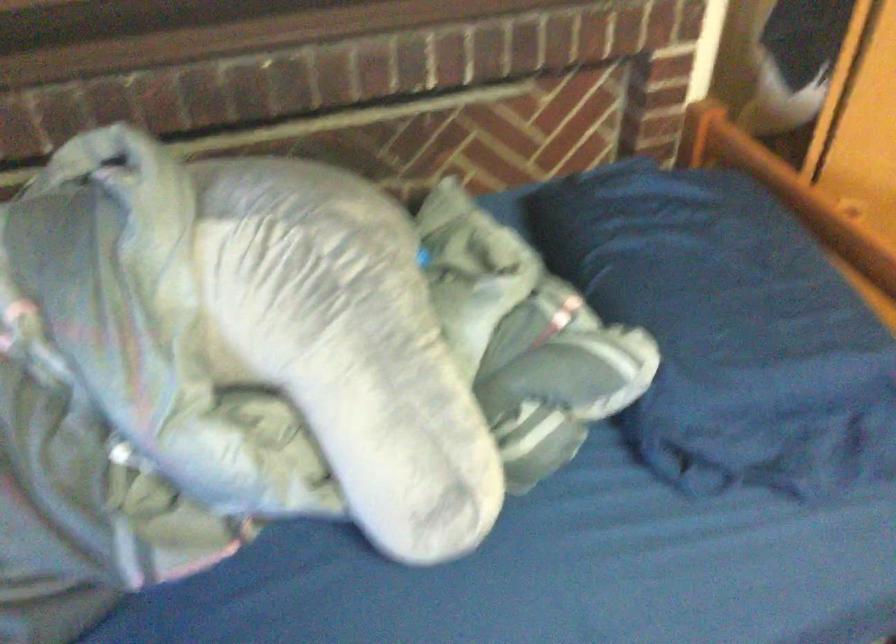
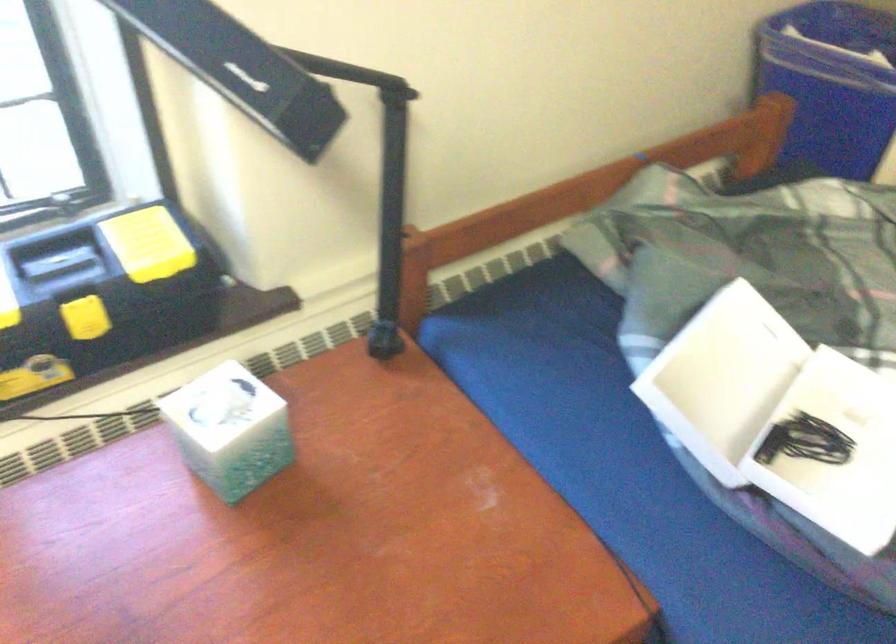
The images are taken continuously from a first-person perspective. In which direction is your viewpoint rotating?

The rotation direction of the camera is left-down.